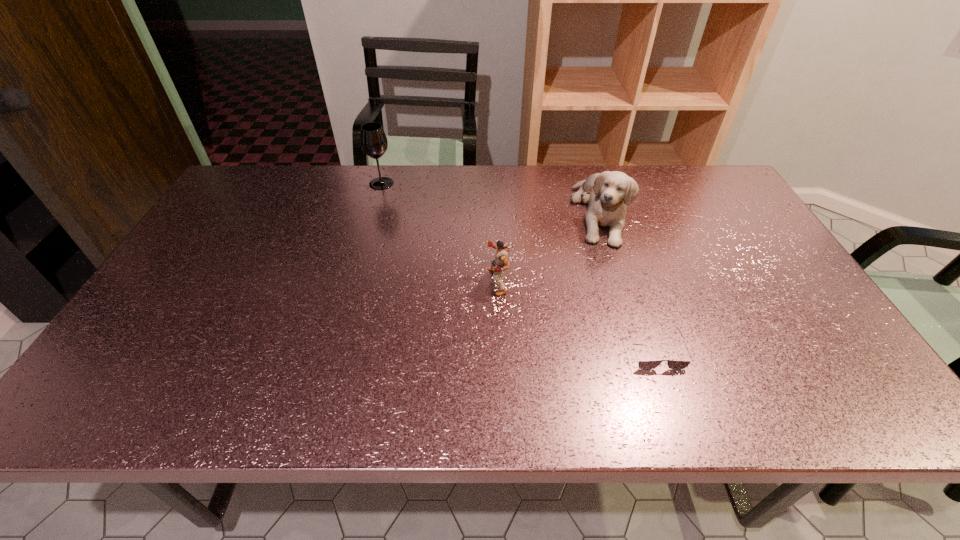
What are the coordinates of `the second closest object to the wineglass` in the screenshot? It's located at (609, 192).

Image resolution: width=960 pixels, height=540 pixels. What are the coordinates of `object that ranks as the closest to the third farthest object` in the screenshot? It's located at coord(609,192).

At what (x,y) coordinates should I click in order to perform the action: click on free space that satisfies the following two spatial constraints: 1. on the front-facing side of the second tallest object; 2. on the front-facing side of the third farthest object. Please return your answer as a coordinate pair (x, y). This screenshot has height=540, width=960. Looking at the image, I should click on (621, 281).

The height and width of the screenshot is (540, 960). Identify the location of vacant space that satisfies the following two spatial constraints: 1. on the front-facing side of the puppy; 2. on the front-facing side of the second nearest object. (621, 281).

This screenshot has width=960, height=540. Find the location of `free space that satisfies the following two spatial constraints: 1. on the front-facing side of the second tallest object; 2. on the front-facing side of the third object from right to left`. free space that satisfies the following two spatial constraints: 1. on the front-facing side of the second tallest object; 2. on the front-facing side of the third object from right to left is located at coordinates (621, 281).